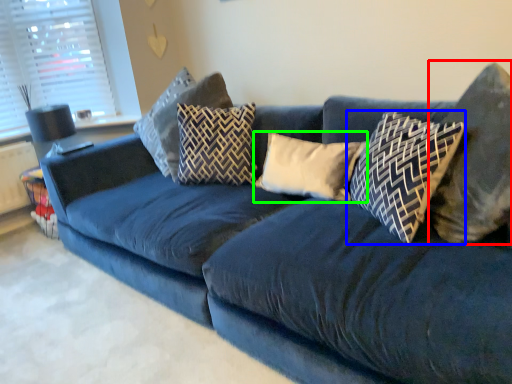
Question: Which is farther away from pillow (highlighted by a red box)? pillow (highlighted by a blue box) or pillow (highlighted by a green box)?

Choices:
 (A) pillow
 (B) pillow

Answer: (B)